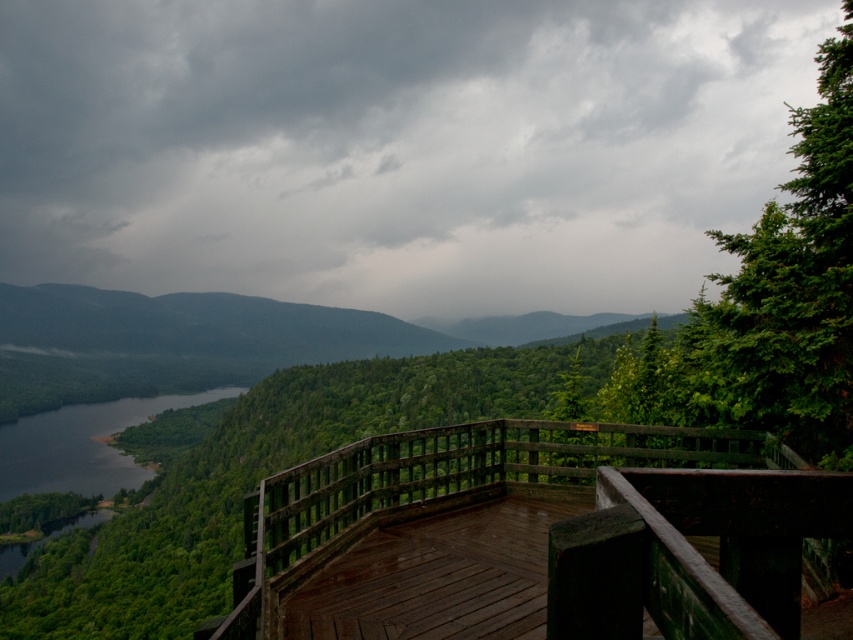
You are an architect designing a new observation deck. You need to ensure that the deck will not be obscured by the dark gray cloud at upper center when viewed from the center. Based on the scene, can the wooden deck at center be seen clearly from the center of the deck?

The dark gray cloud at upper center is bigger than the wooden deck at center, but since the cloud is in the sky and the deck is on the ground, the deck will still be visible from the center of the deck.

You are standing on the wooden deck at center and looking up at the dark gray cloud at upper center. Which object is closer to your eyes?

The dark gray cloud at upper center is closer to your eyes than the wooden deck at center because it is positioned further to the viewer.

You are standing on the wooden deck at center and looking up. You notice a dark gray cloud at upper center. Which object is wider from your perspective?

The dark gray cloud at upper center might be wider than wooden deck at center.